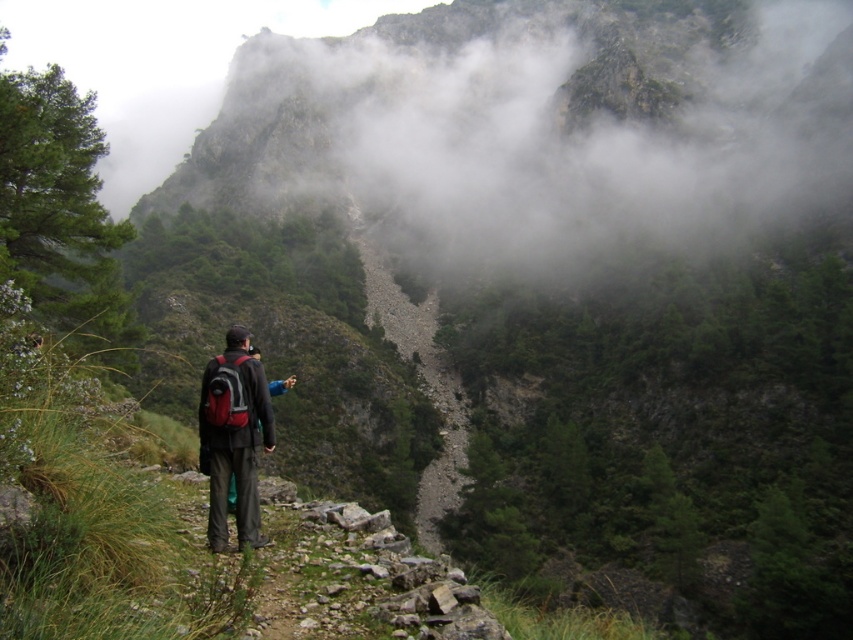
Question: Is gray rocky trail at center wider than matte black backpack at center?

Choices:
 (A) no
 (B) yes

Answer: (B)

Question: Among these points, which one is farthest from the camera?

Choices:
 (A) (445, 486)
 (B) (248, 445)

Answer: (A)

Question: Does gray rocky trail at center appear under matte black backpack at center?

Choices:
 (A) yes
 (B) no

Answer: (B)

Question: Is gray rocky trail at center positioned behind matte black backpack at center?

Choices:
 (A) yes
 (B) no

Answer: (A)